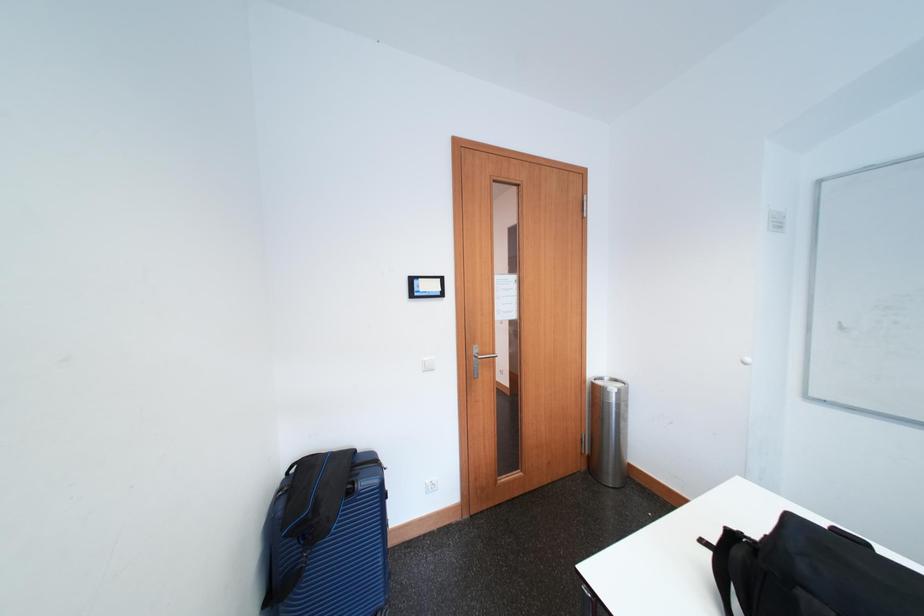
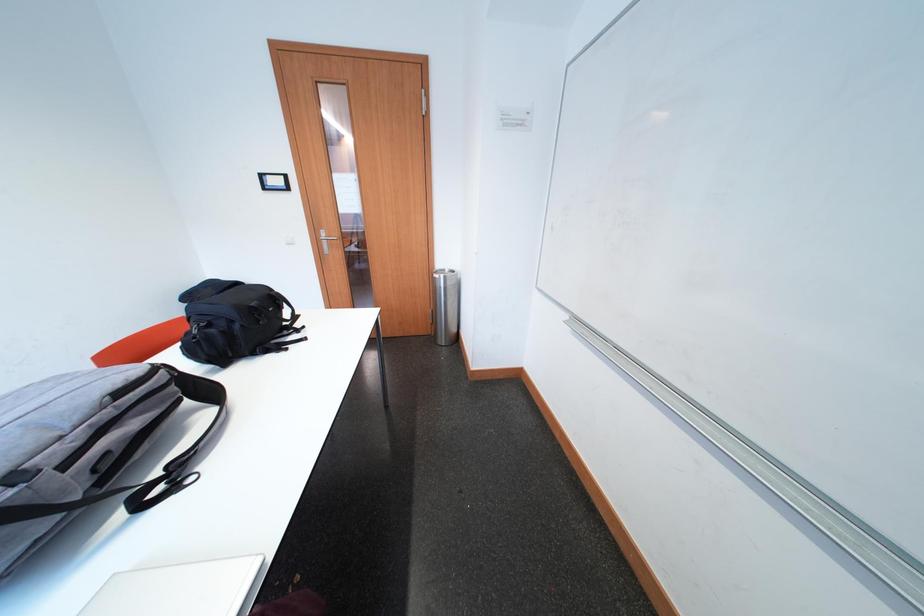
Question: What movement of the cameraman would produce the second image?

Choices:
 (A) Left
 (B) Right
 (C) Forward
 (D) Backward

Answer: (B)